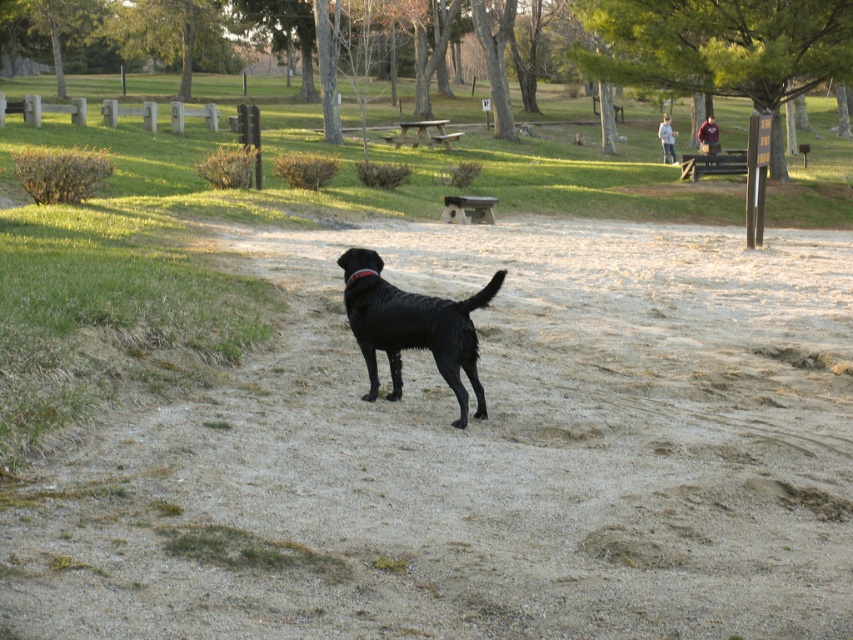
You are a park visitor who wants to take a photo of both the sandy textured dog at center and the shiny black dog at center in the same frame. Given that your camera has a maximum focal length that allows capturing objects up to 2 meters apart, will you be able to include both dogs in one photo?

The sandy textured dog at center and the shiny black dog at center are 2.32 meters apart from each other. Since the distance between them exceeds the camera maximum focal length of 2 meters, you won not be able to capture both dogs in the same photo.

You are a photographer trying to capture both the sandy textured dog at center and the shiny black dog at center in the same frame. Which dog should you adjust your camera angle to focus on first to ensure both are in the frame?

The sandy textured dog at center might be wider than the shiny black dog at center, so you should focus on the wider sandy textured dog at center first to ensure both fit within the frame.